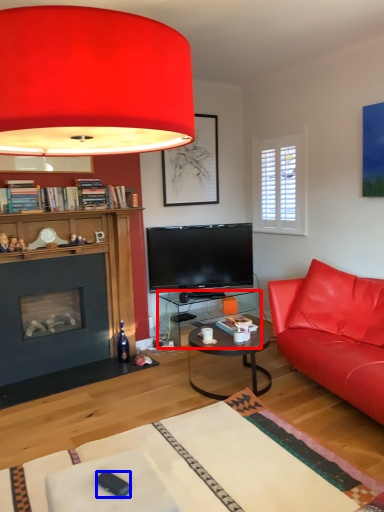
Question: Which object is closer to the camera taking this photo, desk (highlighted by a red box) or remote control (highlighted by a blue box)?

Choices:
 (A) desk
 (B) remote control

Answer: (B)